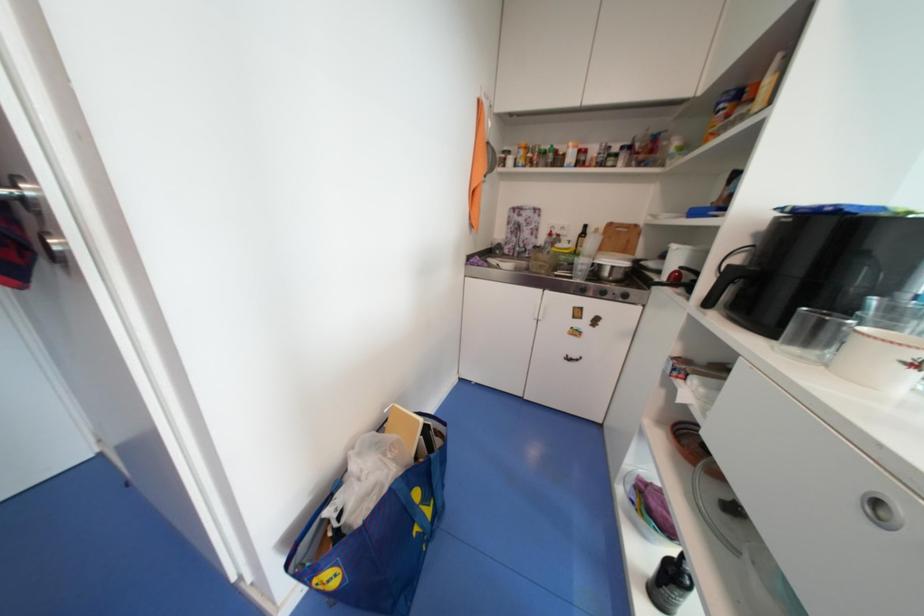
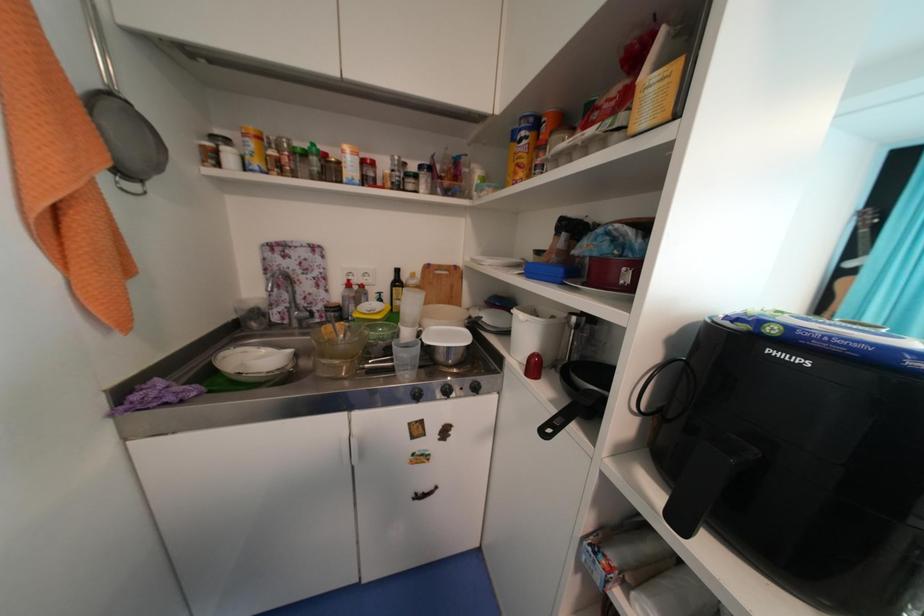
Question: How did the camera likely rotate?

Choices:
 (A) Left
 (B) Right
 (C) Up
 (D) Down

Answer: (B)